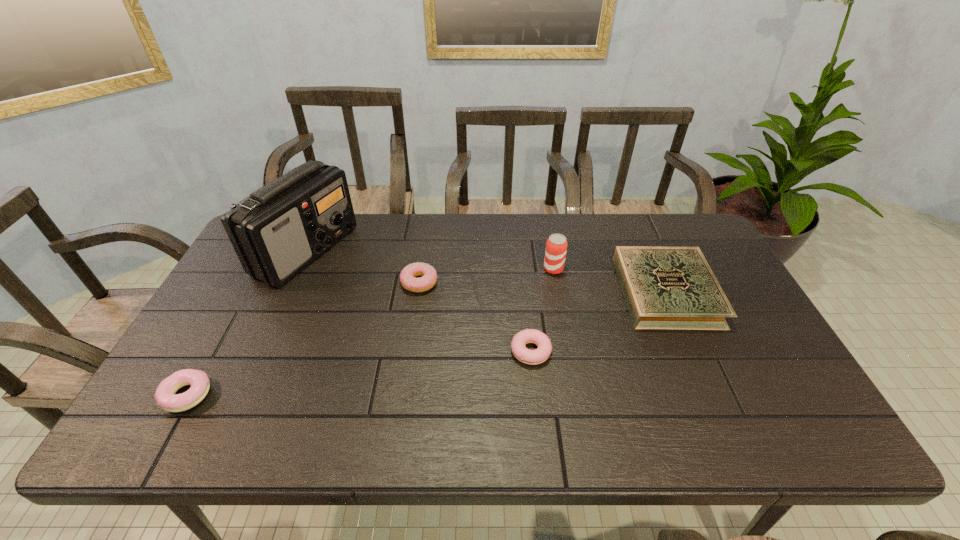
Locate an element on the screen. This screenshot has height=540, width=960. radio receiver is located at coordinates click(277, 231).

Where is `beer can`? beer can is located at coordinates click(x=556, y=247).

At what (x,y) coordinates should I click in order to perform the action: click on the fifth object from left to right. Please return your answer as a coordinate pair (x, y). Image resolution: width=960 pixels, height=540 pixels. Looking at the image, I should click on (556, 247).

Locate an element on the screen. The width and height of the screenshot is (960, 540). hardback book is located at coordinates (674, 288).

You are a GUI agent. You are given a task and a screenshot of the screen. Output one action in this format:
    pyautogui.click(x=<x>, y=<y>)
    Task: Click on the third object from left to right
    This screenshot has height=540, width=960.
    Given the screenshot: What is the action you would take?
    pyautogui.click(x=429, y=277)

At what (x,y) coordinates should I click in order to perform the action: click on the second doughnut from right to left. Please return your answer as a coordinate pair (x, y). Looking at the image, I should click on (429, 277).

The image size is (960, 540). In order to click on the leftmost doughnut in this screenshot , I will do `click(165, 396)`.

What are the coordinates of `the nearest doughnut` in the screenshot? It's located at (165, 396).

What are the coordinates of `the second farthest doughnut` in the screenshot? It's located at (532, 357).

The width and height of the screenshot is (960, 540). In order to click on the fifth farthest object in this screenshot , I will do `click(532, 357)`.